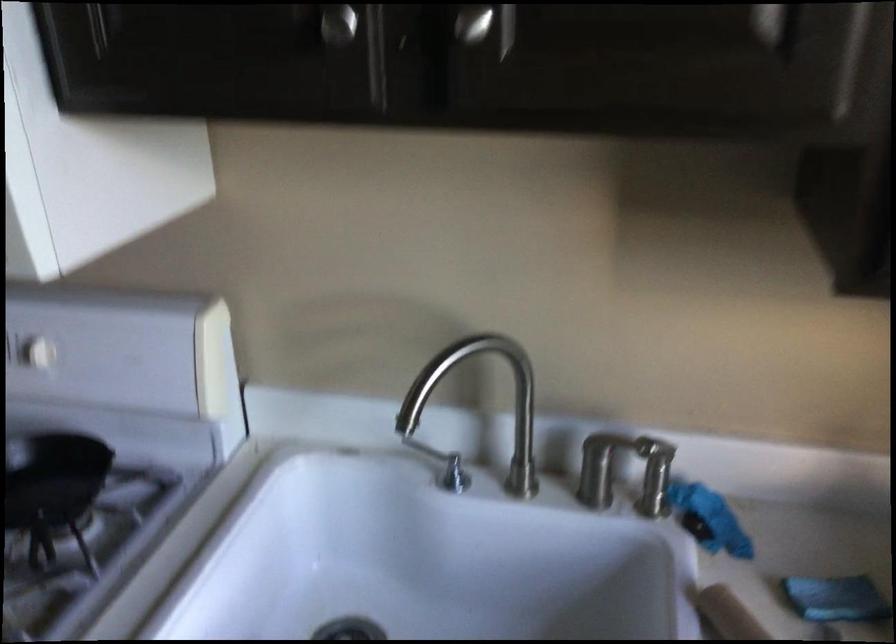
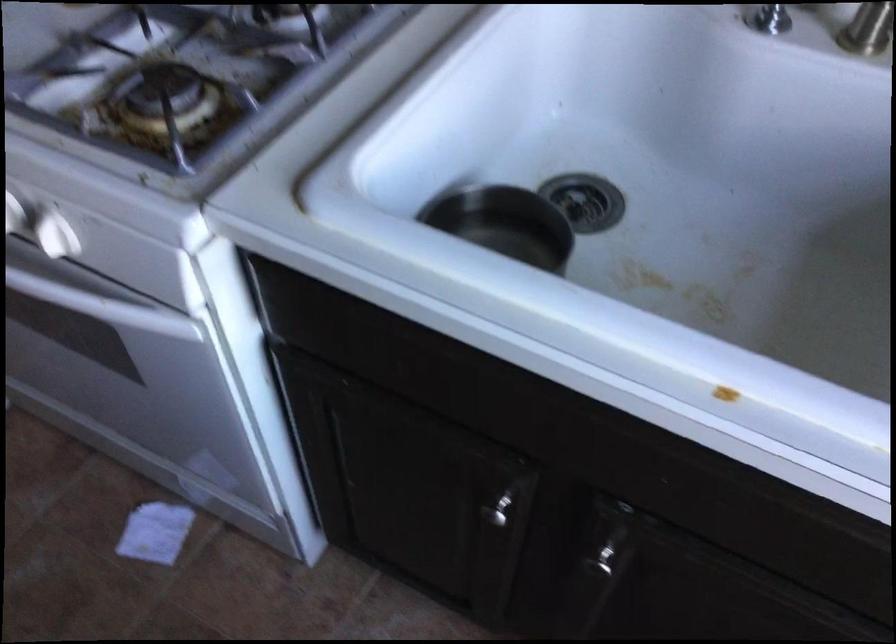
In the second image, find the point that corresponds to (x=472, y=476) in the first image.

(787, 15)